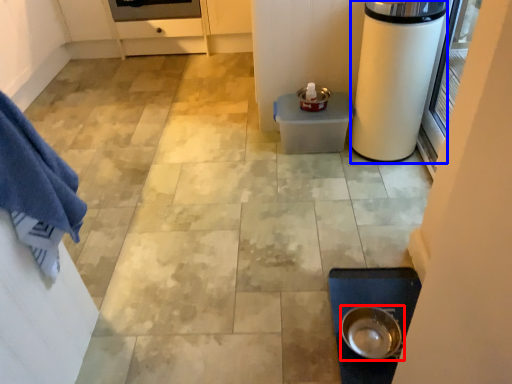
Question: Among these objects, which one is farthest to the camera, kitchen appliance (highlighted by a red box) or appliance (highlighted by a blue box)?

Choices:
 (A) kitchen appliance
 (B) appliance

Answer: (B)